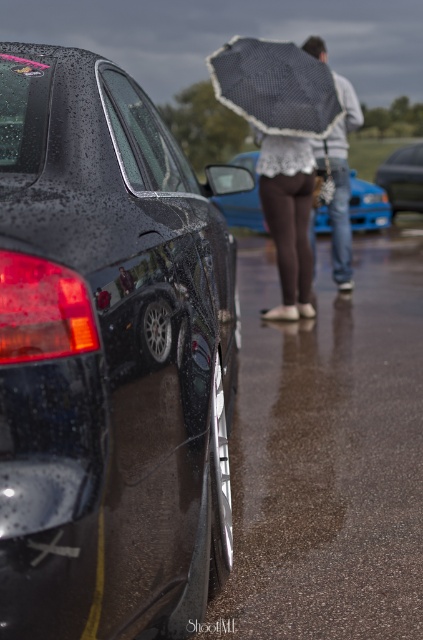
Question: Which object is farther from the camera taking this photo?

Choices:
 (A) metallic blue sedan at center
 (B) black checkered umbrella at upper center

Answer: (A)

Question: Is brown fabric skirt at center below metallic blue sedan at center?

Choices:
 (A) yes
 (B) no

Answer: (A)

Question: Can you confirm if shiny black car at left is positioned above blue metallic sedan at center?

Choices:
 (A) yes
 (B) no

Answer: (B)

Question: Which object is closer to the camera taking this photo?

Choices:
 (A) shiny black car at left
 (B) black checkered umbrella at upper center

Answer: (A)

Question: Which point is closer to the camera?

Choices:
 (A) white lace umbrella at upper center
 (B) metallic blue sedan at center
 (C) white lace umbrella at center

Answer: (C)

Question: Does black checkered umbrella at upper center have a smaller size compared to white lace umbrella at center?

Choices:
 (A) no
 (B) yes

Answer: (B)